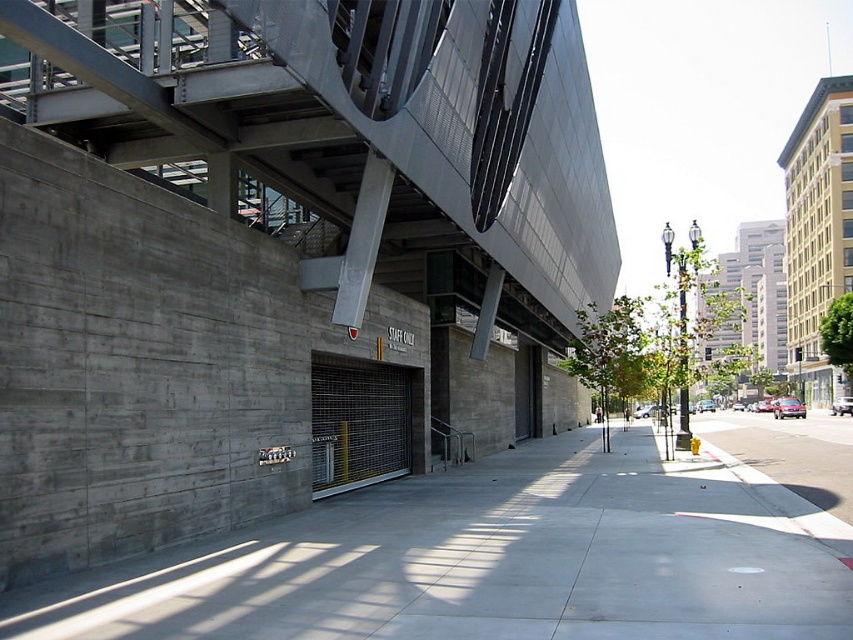
In the scene shown: Which of these two, metallic gray overpass at center or gray concrete sidewalk at center, stands taller?

metallic gray overpass at center

Is metallic gray overpass at center below gray concrete sidewalk at center?

No.

Image resolution: width=853 pixels, height=640 pixels. I want to click on metallic gray overpass at center, so click(354, 122).